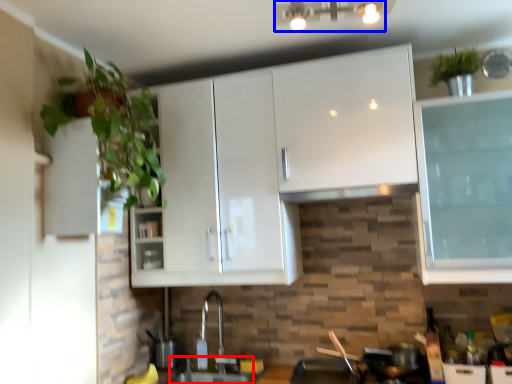
Question: Which point is closer to the camera, sink (highlighted by a red box) or light fixture (highlighted by a blue box)?

Choices:
 (A) sink
 (B) light fixture

Answer: (B)